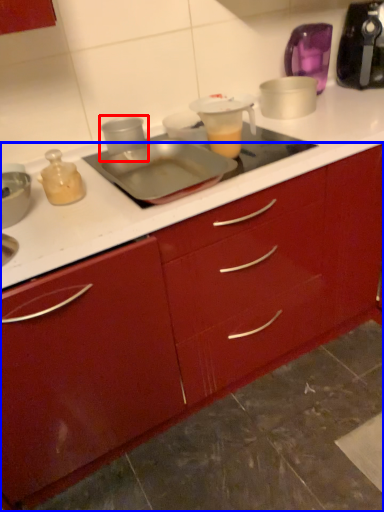
Question: Which object appears farthest to the camera in this image, appliance (highlighted by a red box) or cabinetry (highlighted by a blue box)?

Choices:
 (A) appliance
 (B) cabinetry

Answer: (A)